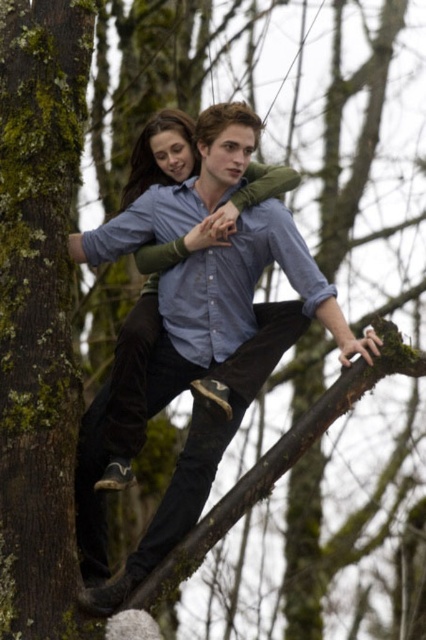
You are standing on the tree branch and need to grab the brown rough bark at left. Based on its position, is it within your immediate reach?

The brown rough bark at left is located at point (39, 308), which indicates it is positioned to the left side of the branch. Since you are on the branch, it should be within your immediate reach.

You are standing on the ground looking up at the two people on the tree branch. Which object, the brown rough bark at left or the matte blue shirt at center, is positioned more to your left side?

The brown rough bark at left is positioned more to your left side than the matte blue shirt at center.